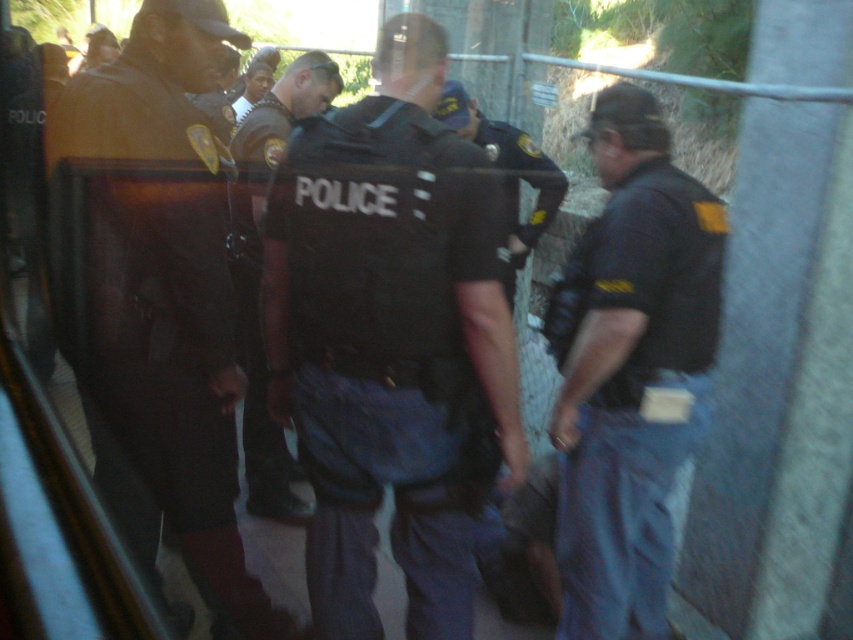
You are a delivery person trying to navigate through the area where the police officers are stationed. You need to pass between the dark brown leather jacket at left and the dark blue uniform at center. Can your delivery cart, which is 4 feet wide, fit through the space between them?

The distance between the dark brown leather jacket at left and the dark blue uniform at center is 3.55 feet. Since your delivery cart is 4 feet wide, it cannot fit through the space between them as the gap is narrower than the cart.

You are a photographer trying to capture a clear photo of both the black matte police vest at center and the dark blue uniform at center from your current position. Can you fit both objects in your camera frame without moving your position? Explain your reasoning.

The black matte police vest at center is only 22.66 inches away from the dark blue uniform at center, so they are close enough to be captured in the same camera frame without needing to move your position.

In the scene shown: You are a designer creating a catalog for police gear. You need to compare the size of the black matte police vest at center and the black uniform at center. Which one takes up more space in the image?

The black uniform at center takes up more space than the black matte police vest at center because the black matte police vest at center occupies less space than black uniform at center.